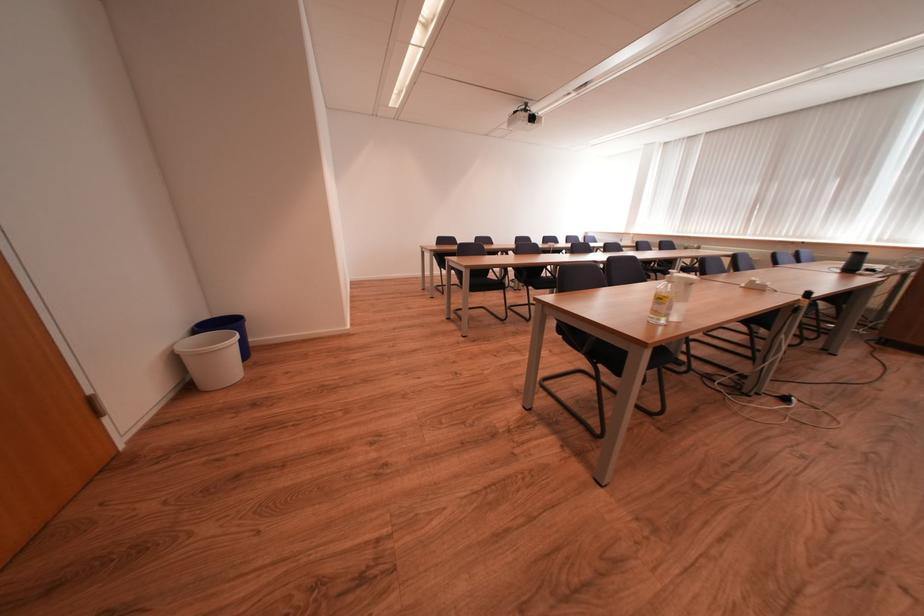
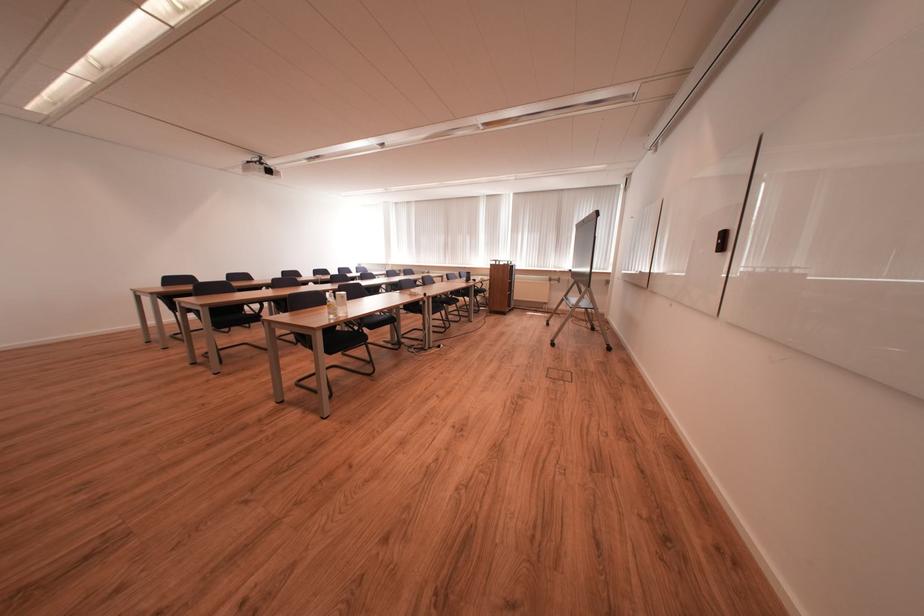
Find the pixel in the second image that matches point (678, 310) in the first image.

(344, 310)